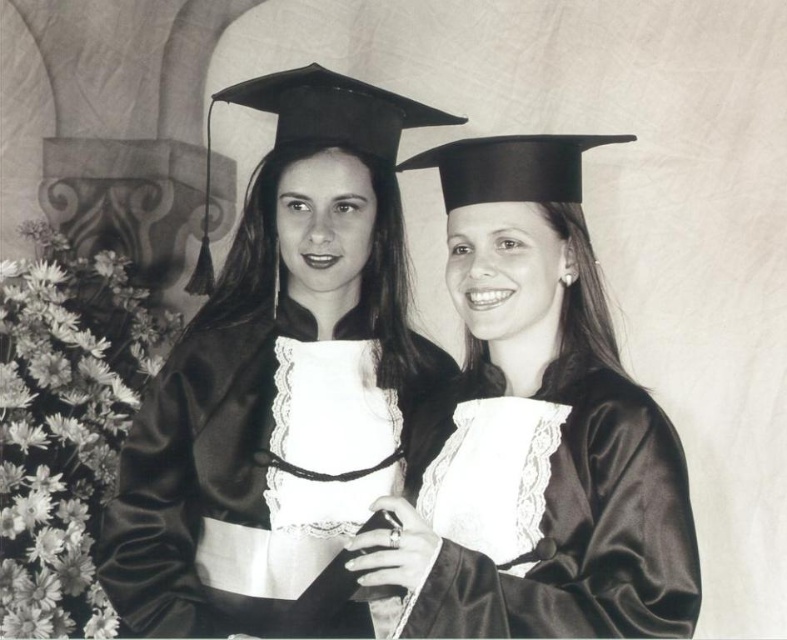
You are a photographer at a graduation ceremony. You need to adjust the lighting so that both the satin black gown at center and the satin black graduation gown at center are equally illuminated. However, you notice that one is currently in shadow. Which gown should you adjust the light towards to ensure both are properly lit?

The satin black graduation gown at center is behind the satin black gown at center, so the one in front might be blocking some light. To ensure both are properly lit, adjust the light towards the satin black graduation gown at center which is behind to compensate for any shadowing caused by the front gown.

You are a photographer who needs to adjust the lighting to ensure both the satin black gown at center and the satin black graduation gown at center are equally visible. Considering their widths, which gown requires more light to achieve the same level of brightness?

The satin black gown at center has a greater width than the satin black graduation gown at center. To achieve the same level of brightness, the wider satin black gown at center requires more light since it covers a larger area and thus needs more illumination to maintain visibility compared to the narrower satin black graduation gown at center.